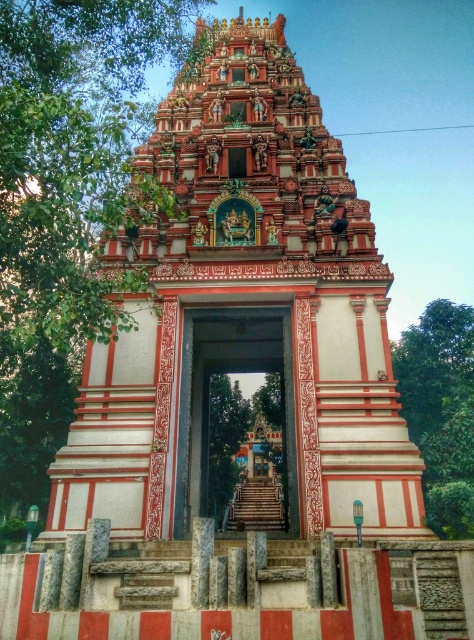
From the picture: You are standing in front of the temple and notice two points marked on the structure. The first point is at coordinates point [222,160] and the second is at point [277,371]. Which of these points is nearer to your current position?

Point [222,160] is closer to the camera than point [277,371], so the first point is nearer to your current position.

You are an architect visiting the temple and need to determine the spatial relationship between the two structures. Based on the scene, which of the two, the polished stone temple at center or the polished stone gate at center, occupies more space in the image?

The polished stone temple at center is bigger than the polished stone gate at center, so it occupies more space in the image.